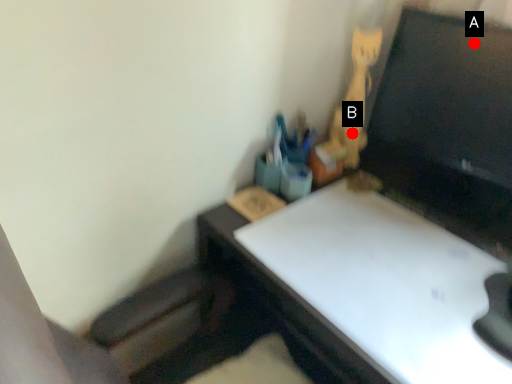
Question: Two points are circled on the image, labeled by A and B beside each circle. Which point is closer to the camera?

Choices:
 (A) A is closer
 (B) B is closer

Answer: (A)